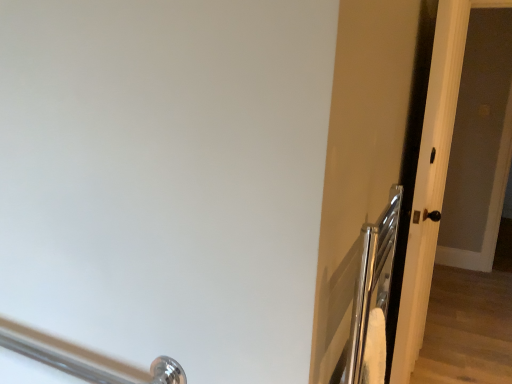
The width and height of the screenshot is (512, 384). In order to click on matte black door at right in this screenshot , I will do `click(424, 181)`.

Describe the element at coordinates (424, 181) in the screenshot. I see `matte black door at right` at that location.

You are a GUI agent. You are given a task and a screenshot of the screen. Output one action in this format:
    pyautogui.click(x=<x>, y=<y>)
    Task: Click on the matte black door at right
    The image size is (512, 384).
    Given the screenshot: What is the action you would take?
    pyautogui.click(x=424, y=181)